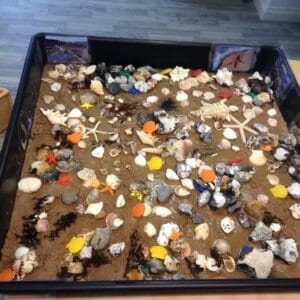
Locate an element on the screen. floor is located at coordinates (225, 20).